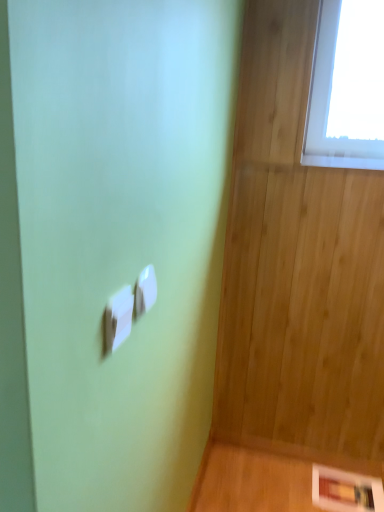
Question: Does white plastic light switch at center, placed as the 1th light switch when sorted from front to back, have a lesser height compared to white glossy picture frame at lower right?

Choices:
 (A) yes
 (B) no

Answer: (B)

Question: Is white plastic light switch at center, the 1th light switch when ordered from left to right, touching white glossy picture frame at lower right?

Choices:
 (A) no
 (B) yes

Answer: (A)

Question: Can you confirm if white plastic light switch at center, placed as the 1th light switch when sorted from front to back, is smaller than white glossy picture frame at lower right?

Choices:
 (A) yes
 (B) no

Answer: (A)

Question: From a real-world perspective, is white plastic light switch at center, placed as the 1th light switch when sorted from front to back, positioned under white glossy picture frame at lower right based on gravity?

Choices:
 (A) no
 (B) yes

Answer: (A)

Question: Are white plastic light switch at center, placed as the 1th light switch when sorted from front to back, and white glossy picture frame at lower right far apart?

Choices:
 (A) no
 (B) yes

Answer: (B)

Question: Considering the relative sizes of white plastic light switch at center, the second light switch when ordered from right to left, and white glossy picture frame at lower right in the image provided, is white plastic light switch at center, the second light switch when ordered from right to left, wider than white glossy picture frame at lower right?

Choices:
 (A) no
 (B) yes

Answer: (A)

Question: Are white plastic light switch at center, which ranks as the 1th light switch in right-to-left order, and white plastic light switch at center, the 1th light switch when ordered from left to right, far apart?

Choices:
 (A) yes
 (B) no

Answer: (B)

Question: Considering the relative sizes of white plastic light switch at center, which is counted as the first light switch, starting from the back, and white plastic light switch at center, the second light switch when ordered from right to left, in the image provided, is white plastic light switch at center, which is counted as the first light switch, starting from the back, thinner than white plastic light switch at center, the second light switch when ordered from right to left,?

Choices:
 (A) no
 (B) yes

Answer: (B)

Question: Can you confirm if white plastic light switch at center, which is counted as the first light switch, starting from the back, is wider than white plastic light switch at center, the second light switch when ordered from right to left?

Choices:
 (A) yes
 (B) no

Answer: (B)

Question: Is white plastic light switch at center, which appears as the second light switch when viewed from the left, placed right next to white plastic light switch at center, the 2th light switch positioned from the back?

Choices:
 (A) yes
 (B) no

Answer: (A)

Question: Is white plastic light switch at center, the 2th light switch positioned from the back, surrounded by white plastic light switch at center, which ranks as the 1th light switch in right-to-left order?

Choices:
 (A) yes
 (B) no

Answer: (B)

Question: Is white plastic light switch at center, which appears as the second light switch when viewed from the left, further to the viewer compared to white plastic light switch at center, placed as the 1th light switch when sorted from front to back?

Choices:
 (A) yes
 (B) no

Answer: (A)

Question: Is white glossy picture frame at lower right to the left of white plastic light switch at center, placed as the 1th light switch when sorted from front to back, from the viewer's perspective?

Choices:
 (A) yes
 (B) no

Answer: (B)